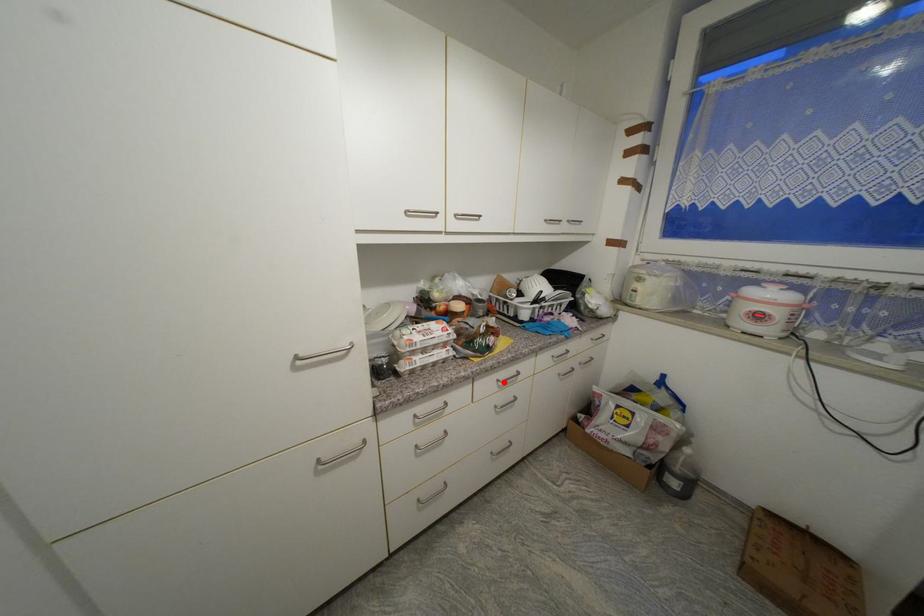
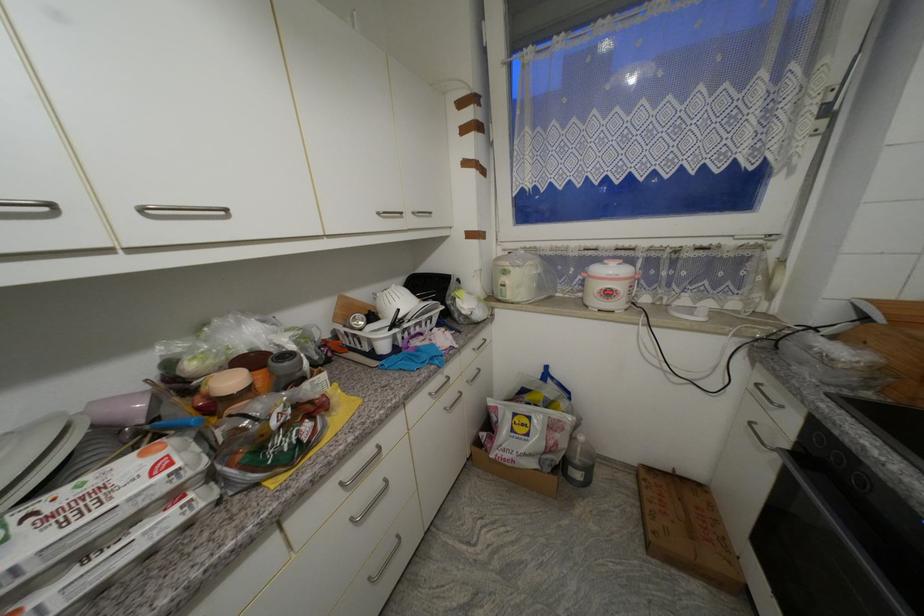
Locate, in the second image, the point that corresponds to the highlighted location in the first image.

(347, 485)